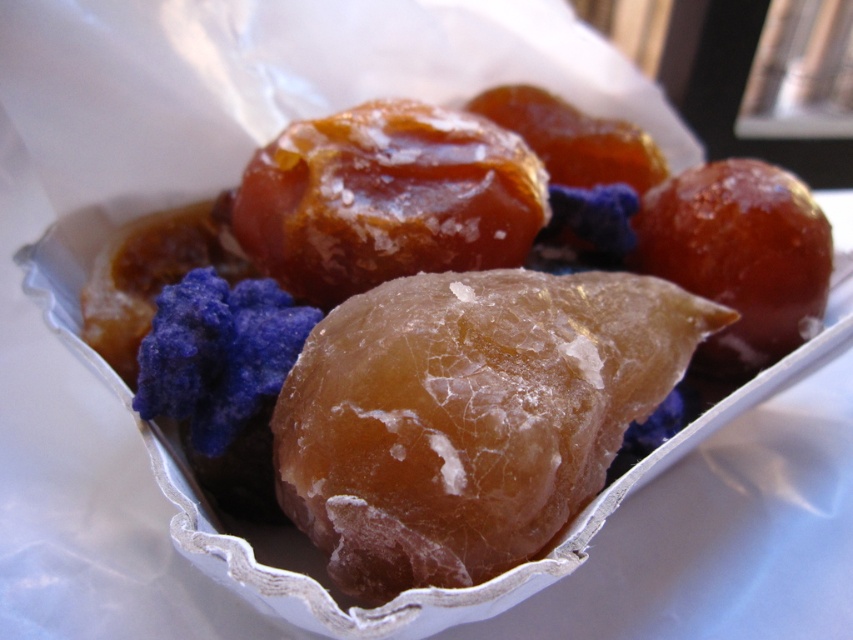
Does glossy caramel treat at center have a greater width compared to glossy caramel candy at center?

Yes.

This screenshot has height=640, width=853. Identify the location of glossy caramel treat at center. (456, 237).

Is point (303, 257) farther from camera compared to point (358, 252)?

Yes, it is behind point (358, 252).

Where is `glossy caramel treat at center`? The width and height of the screenshot is (853, 640). glossy caramel treat at center is located at coordinates (456, 237).